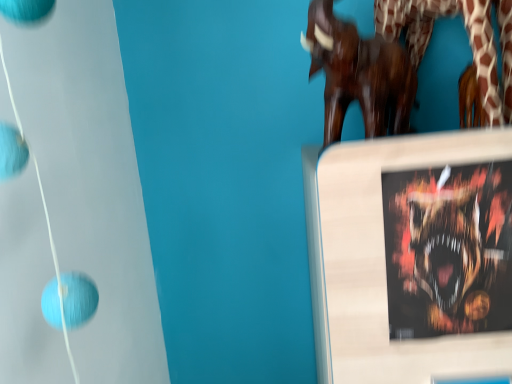
Question: Does wooden sculpture at upper right appear on the left side of shiny metallic poster at upper right?

Choices:
 (A) no
 (B) yes

Answer: (B)

Question: From a real-world perspective, is wooden sculpture at upper right located higher than shiny metallic poster at upper right?

Choices:
 (A) yes
 (B) no

Answer: (A)

Question: From the image's perspective, would you say wooden sculpture at upper right is shown under shiny metallic poster at upper right?

Choices:
 (A) no
 (B) yes

Answer: (A)

Question: Considering the relative sizes of wooden sculpture at upper right and shiny metallic poster at upper right in the image provided, is wooden sculpture at upper right taller than shiny metallic poster at upper right?

Choices:
 (A) no
 (B) yes

Answer: (A)

Question: Is wooden sculpture at upper right positioned in front of shiny metallic poster at upper right?

Choices:
 (A) no
 (B) yes

Answer: (A)

Question: Is wooden sculpture at upper right not within shiny metallic poster at upper right?

Choices:
 (A) no
 (B) yes

Answer: (B)

Question: Is shiny metallic poster at upper right in front of wooden sculpture at upper right?

Choices:
 (A) no
 (B) yes

Answer: (B)

Question: From the image's perspective, is shiny metallic poster at upper right on wooden sculpture at upper right?

Choices:
 (A) yes
 (B) no

Answer: (B)

Question: From a real-world perspective, is shiny metallic poster at upper right on wooden sculpture at upper right?

Choices:
 (A) no
 (B) yes

Answer: (A)

Question: Is shiny metallic poster at upper right facing towards wooden sculpture at upper right?

Choices:
 (A) yes
 (B) no

Answer: (B)

Question: Considering the relative sizes of shiny metallic poster at upper right and wooden sculpture at upper right in the image provided, is shiny metallic poster at upper right bigger than wooden sculpture at upper right?

Choices:
 (A) yes
 (B) no

Answer: (B)

Question: Can wooden sculpture at upper right be found inside shiny metallic poster at upper right?

Choices:
 (A) yes
 (B) no

Answer: (B)

Question: From a real-world perspective, is wooden sculpture at upper right physically located above or below shiny metallic poster at upper right?

Choices:
 (A) above
 (B) below

Answer: (A)